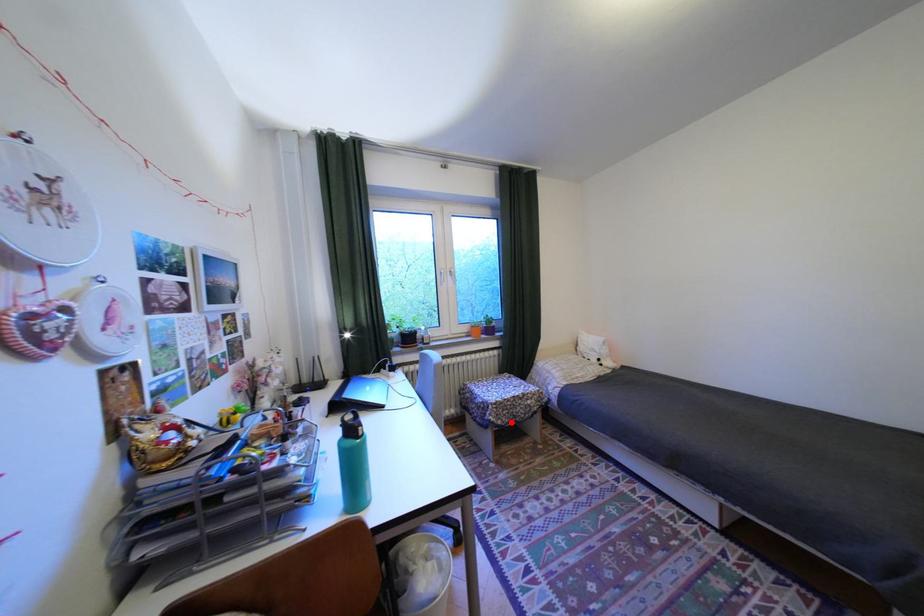
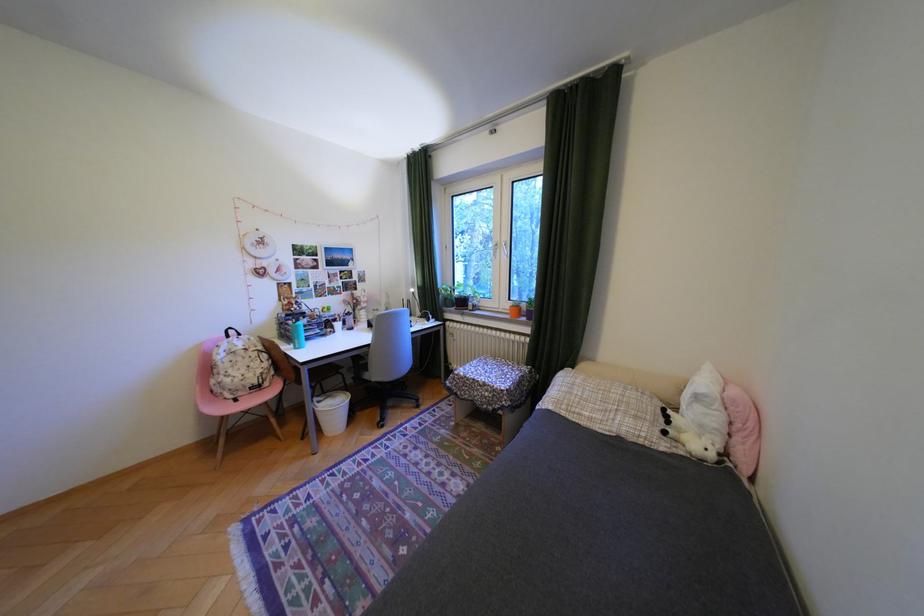
Locate, in the second image, the point that corresponds to the highlighted location in the first image.

(470, 392)